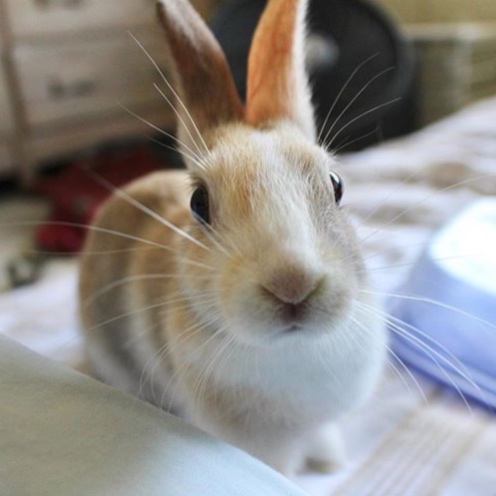
Where is `bowl`? The height and width of the screenshot is (496, 496). bowl is located at coordinates (484, 305).